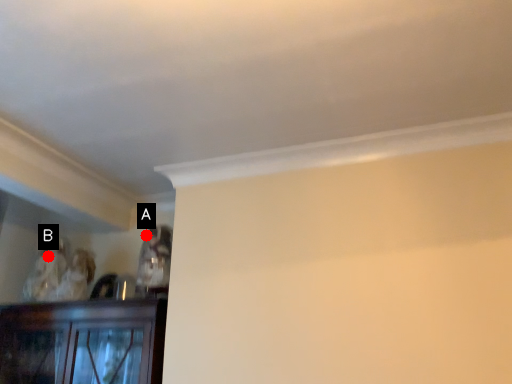
Question: Two points are circled on the image, labeled by A and B beside each circle. Which point appears farthest from the camera in this image?

Choices:
 (A) A is further
 (B) B is further

Answer: (B)